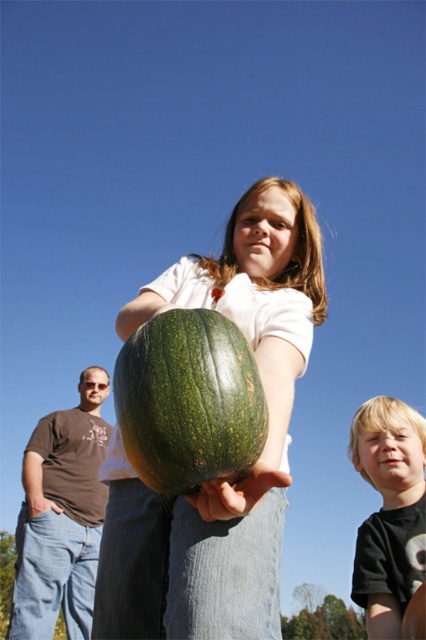
Question: Does green matte/glossy gourd at center appear on the right side of blonde hair boy at lower right?

Choices:
 (A) no
 (B) yes

Answer: (A)

Question: Based on their relative distances, which object is nearer to the green matte pumpkin at center?

Choices:
 (A) green matte/glossy gourd at center
 (B) brown cotton shirt at left
 (C) blonde hair boy at lower right

Answer: (A)

Question: Can you confirm if green matte/glossy gourd at center is positioned above brown cotton shirt at left?

Choices:
 (A) yes
 (B) no

Answer: (A)

Question: Which of the following is the farthest from the observer?

Choices:
 (A) green matte/glossy gourd at center
 (B) brown cotton shirt at left

Answer: (B)

Question: Which of the following is the closest to the observer?

Choices:
 (A) green matte/glossy gourd at center
 (B) green matte pumpkin at center
 (C) blonde hair boy at lower right
 (D) brown cotton shirt at left

Answer: (A)

Question: Is green matte pumpkin at center above blonde hair boy at lower right?

Choices:
 (A) no
 (B) yes

Answer: (B)